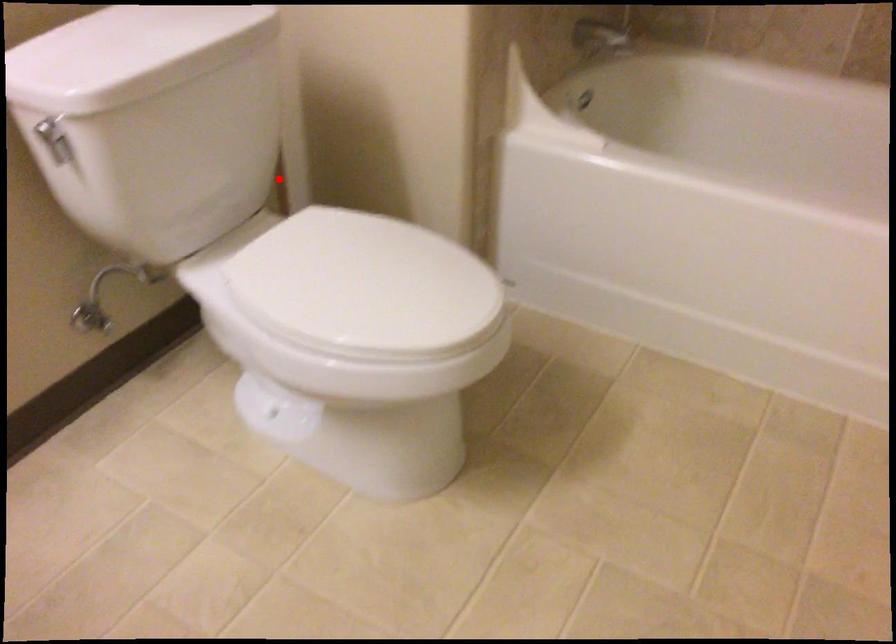
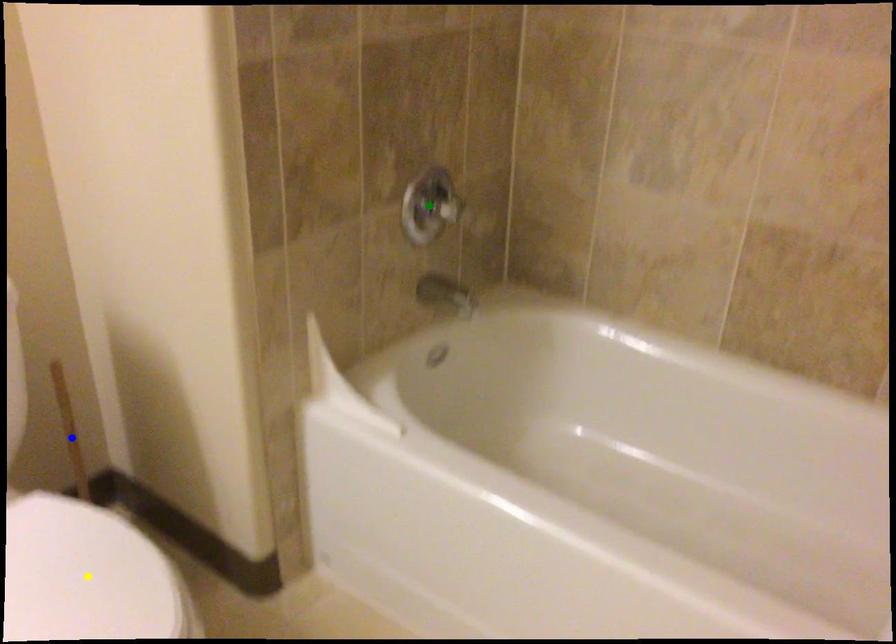
Question: I am providing you with two images of the same scene from different viewpoints. A red point is marked on the first image. You are given multiple points on the second image. Which point in image 2 is actually the same real-world point as the red point in image 1?

Choices:
 (A) green point
 (B) blue point
 (C) yellow point

Answer: (B)